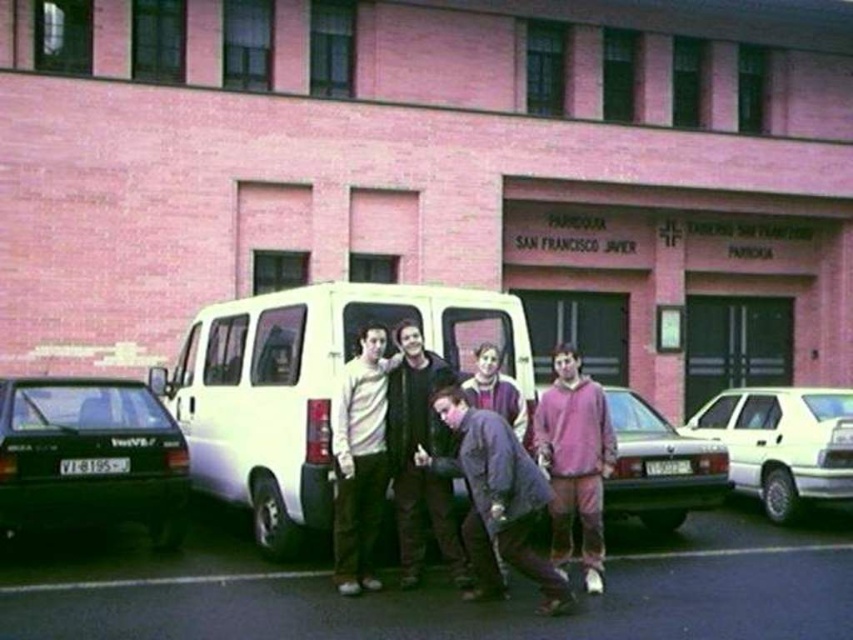
You are a photographer trying to capture a group photo of the five individuals in front of the pink brick building. You want to ensure that the white matte van at center and the pink matte car at center do not block the background of the building. Which vehicle should you move to make more space?

The white matte van at center is wider than the pink matte car at center. To make more space, you should move the white matte van at center since it occupies a larger area.

You are a photographer trying to capture a photo of the group without any vehicles in the background. The white matte van at center and purple fleece sweatshirt at center are in your current frame. Which object should you move closer to in order to avoid the van?

The white matte van at center is wider than the purple fleece sweatshirt at center, so moving closer to the purple fleece sweatshirt at center would help avoid the van since it is narrower.

You are standing at the point labeled point (308, 387) in the image. Which object are you touching?

The point labeled point (308, 387) is on the white matte van at center, so you are touching the white matte van at center.